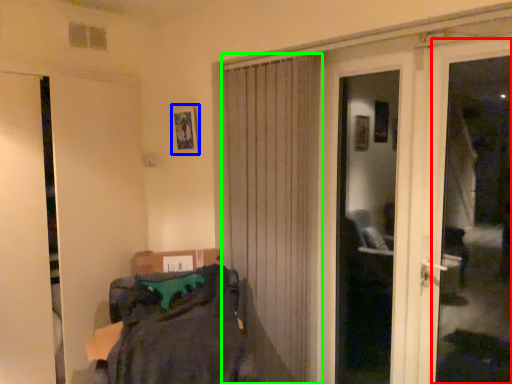
Question: Which object is positioned farthest from window frame (highlighted by a red box)? Select from picture frame (highlighted by a blue box) and curtain (highlighted by a green box).

Choices:
 (A) picture frame
 (B) curtain

Answer: (A)